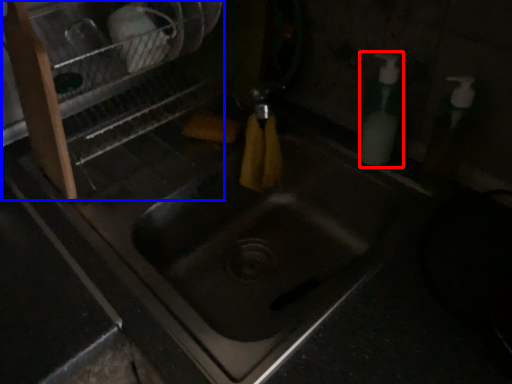
Question: Which object is closer to the camera taking this photo, soap dispenser (highlighted by a red box) or dish washer (highlighted by a blue box)?

Choices:
 (A) soap dispenser
 (B) dish washer

Answer: (B)